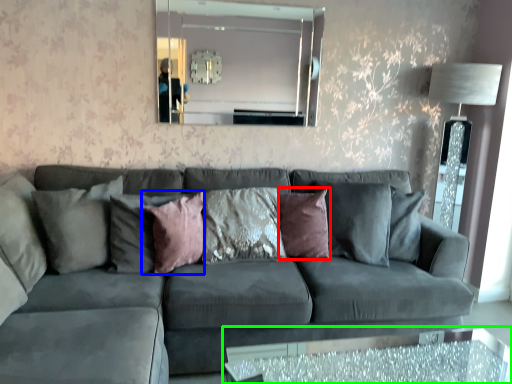
Question: Which is nearer to the pillow (highlighted by a red box)? pillow (highlighted by a blue box) or table (highlighted by a green box).

Choices:
 (A) pillow
 (B) table

Answer: (A)